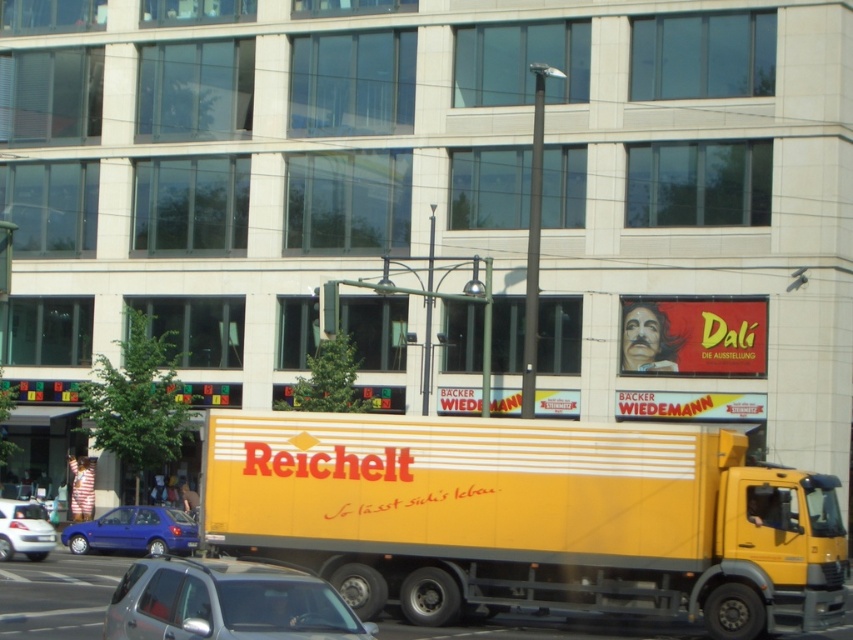
You are a delivery driver trying to park your 1.8 meters wide van between the silver metallic car at lower left and the metallic blue hatchback at lower left. Can you fit your van in the space between them?

The silver metallic car at lower left might be wider than metallic blue hatchback at lower left, so the space between them may not be wide enough for your van which is 1.8 meters wide. It is uncertain whether the space is sufficient without knowing the exact width of the cars.

You are a pedestrian standing at the edge of the street. You see the yellow matte truck at center and the silver metallic car at lower left. Which vehicle is positioned higher in the image?

The yellow matte truck at center is positioned higher than the silver metallic car at lower left in the image.